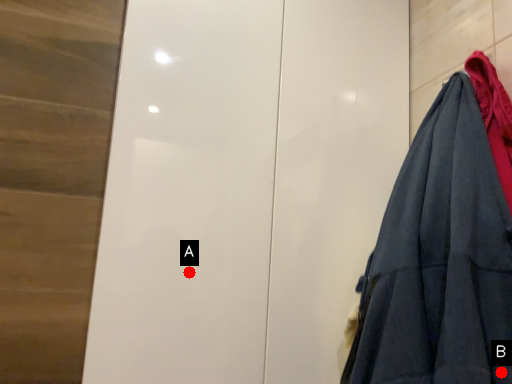
Question: Two points are circled on the image, labeled by A and B beside each circle. Which point is further to the camera?

Choices:
 (A) A is further
 (B) B is further

Answer: (A)